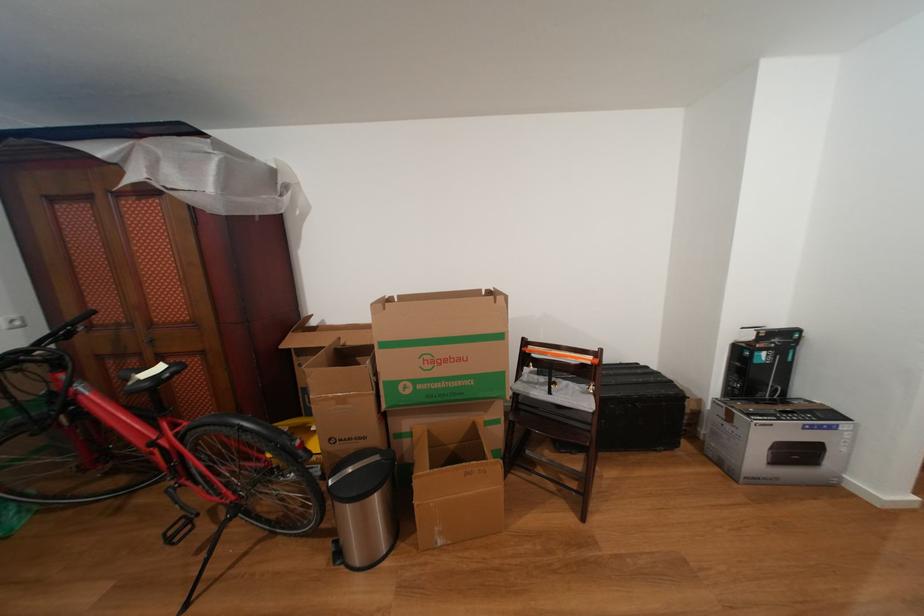
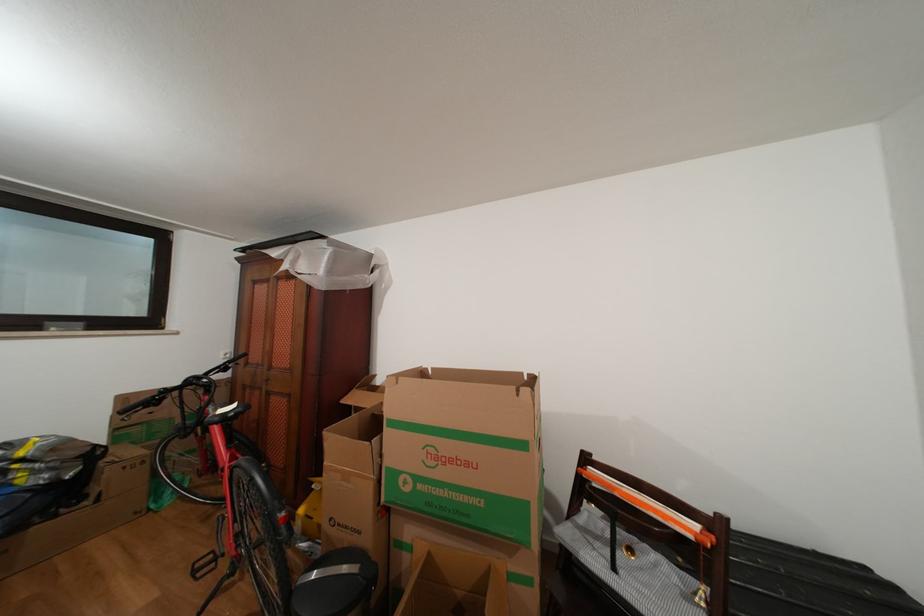
The point at [89,392] is marked in the first image. Where is the corresponding point in the second image?

(219, 414)